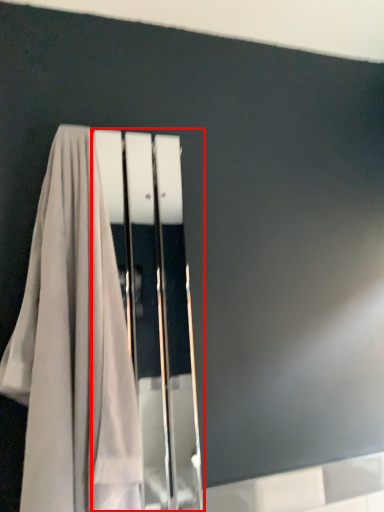
Question: From the image's perspective, where is screen door (annotated by the red box) located relative to towel?

Choices:
 (A) above
 (B) below

Answer: (B)